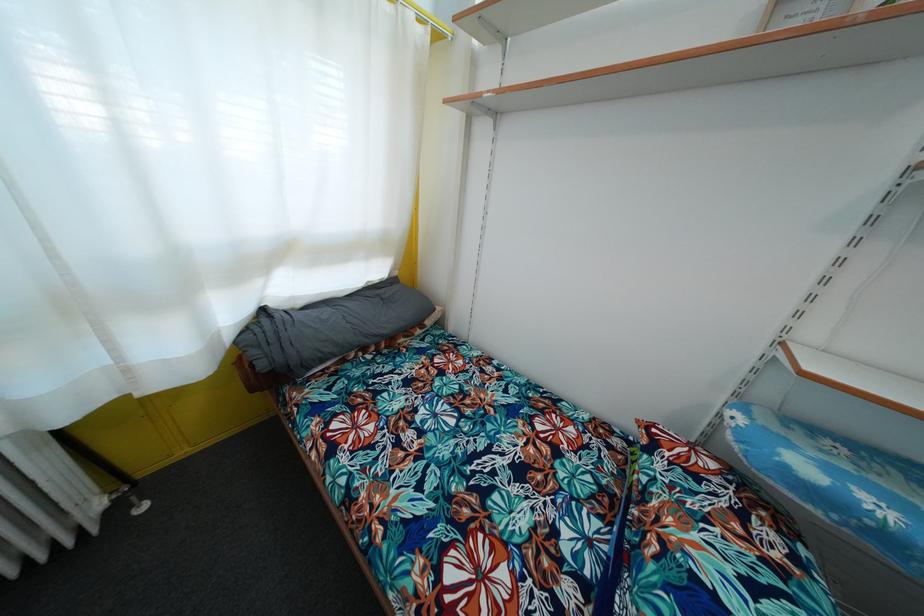
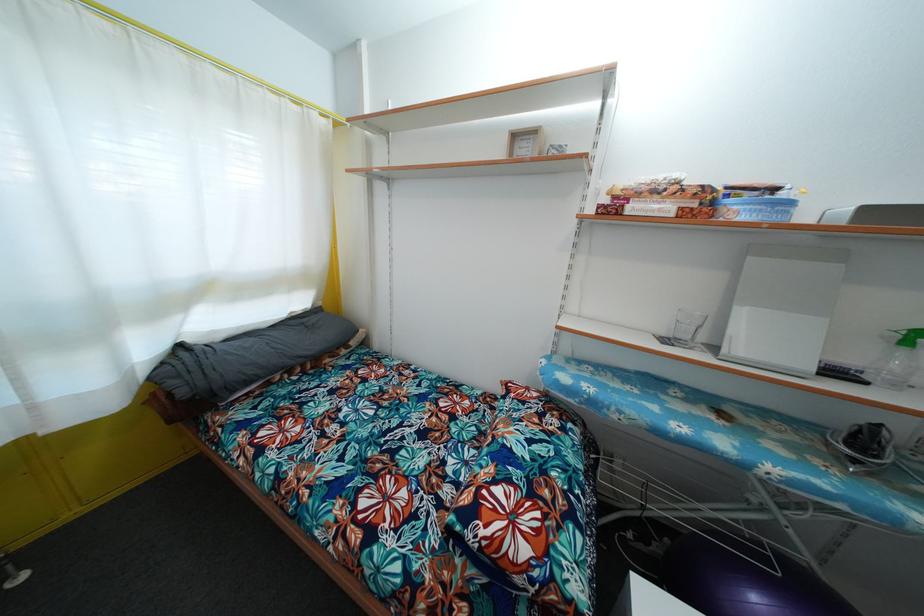
Find the pixel in the second image that matches the point at 265,371 in the first image.

(187, 399)